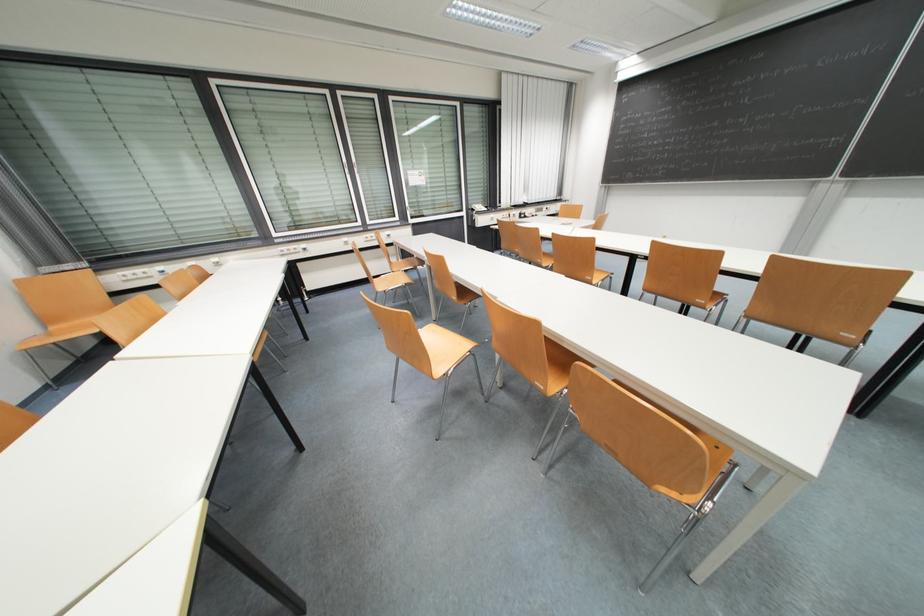
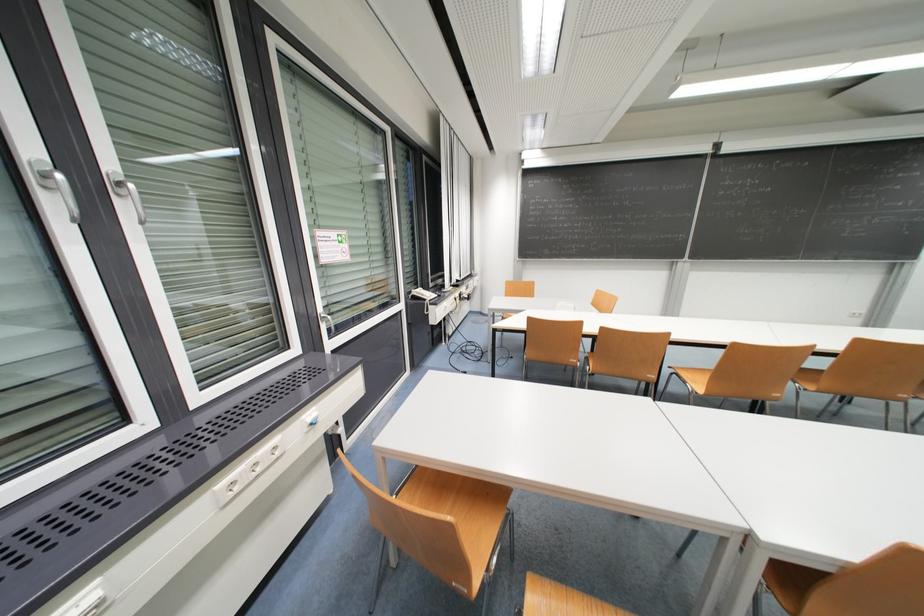
Locate, in the second image, the point that corresponds to (x=558, y=236) in the first image.

(739, 346)